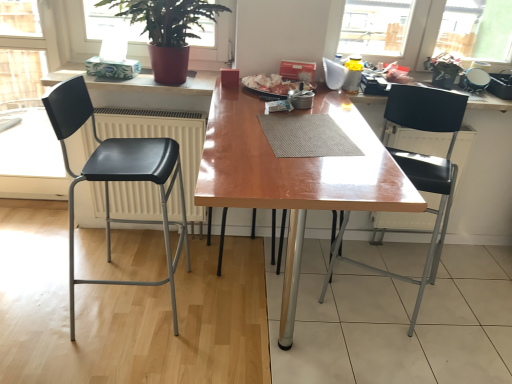
Where is `free space that is in between wooden table at center and black matte chair at left, which is counted as the 1th chair, starting from the left`? This screenshot has width=512, height=384. free space that is in between wooden table at center and black matte chair at left, which is counted as the 1th chair, starting from the left is located at coordinates (164, 315).